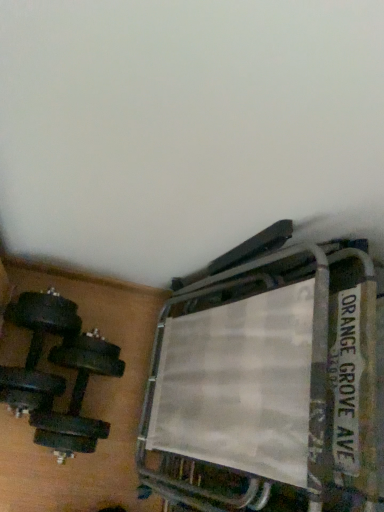
Question: Is black rubber dumbbell at lower left positioned before metallic silver bunk bed at upper right?

Choices:
 (A) yes
 (B) no

Answer: (B)

Question: Is black rubber dumbbell at lower left oriented towards metallic silver bunk bed at upper right?

Choices:
 (A) no
 (B) yes

Answer: (A)

Question: From the image's perspective, does black rubber dumbbell at lower left appear lower than metallic silver bunk bed at upper right?

Choices:
 (A) no
 (B) yes

Answer: (B)

Question: Is black rubber dumbbell at lower left positioned far away from metallic silver bunk bed at upper right?

Choices:
 (A) no
 (B) yes

Answer: (A)

Question: Can you confirm if black rubber dumbbell at lower left is positioned to the right of metallic silver bunk bed at upper right?

Choices:
 (A) no
 (B) yes

Answer: (A)

Question: Can you confirm if black rubber dumbbell at lower left is smaller than metallic silver bunk bed at upper right?

Choices:
 (A) no
 (B) yes

Answer: (B)

Question: Can you confirm if metallic silver bunk bed at upper right is positioned to the left of black rubber dumbbell at lower left?

Choices:
 (A) yes
 (B) no

Answer: (B)

Question: From a real-world perspective, is metallic silver bunk bed at upper right physically below black rubber dumbbell at lower left?

Choices:
 (A) no
 (B) yes

Answer: (A)

Question: From the image's perspective, is metallic silver bunk bed at upper right below black rubber dumbbell at lower left?

Choices:
 (A) yes
 (B) no

Answer: (B)

Question: From the image's perspective, is metallic silver bunk bed at upper right on top of black rubber dumbbell at lower left?

Choices:
 (A) no
 (B) yes

Answer: (B)

Question: Does metallic silver bunk bed at upper right have a lesser width compared to black rubber dumbbell at lower left?

Choices:
 (A) no
 (B) yes

Answer: (B)

Question: Is metallic silver bunk bed at upper right aimed at black rubber dumbbell at lower left?

Choices:
 (A) no
 (B) yes

Answer: (B)

Question: From the image's perspective, is black rubber dumbbell at lower left located above or below metallic silver bunk bed at upper right?

Choices:
 (A) above
 (B) below

Answer: (B)